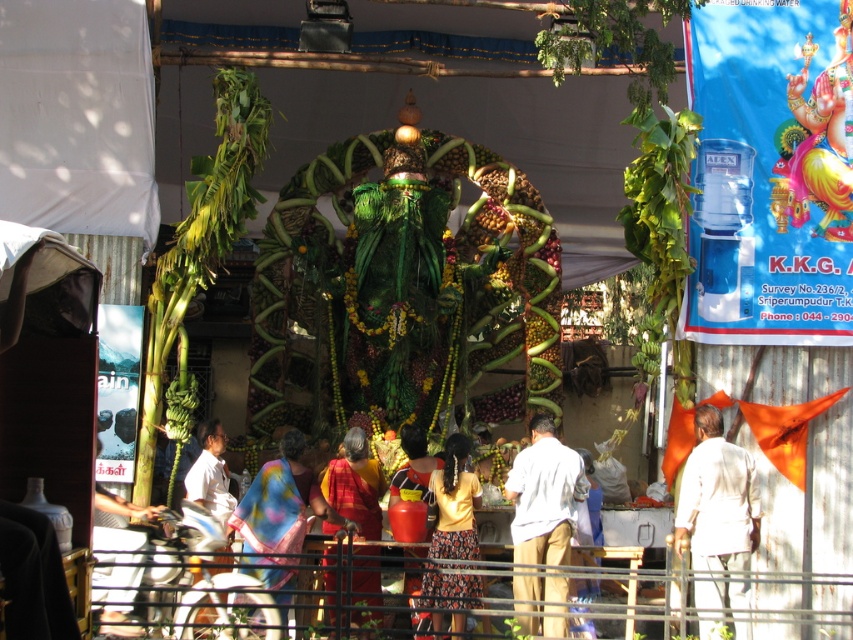
You are a photographer aiming to capture the metallic wire fence at lower center and the silky pink saree at center in a single frame. Considering their sizes, which object would require you to adjust your camera angle more to ensure both are fully visible?

The metallic wire fence at lower center requires more adjustment because its width surpasses that of the silky pink saree at center, necessitating a wider angle or closer positioning to accommodate its larger size while keeping both in frame.

You are part of the ceremony and need to cover the deity structure with the white cloth at center and the red silk saree at center. Which one can completely cover the structure due to its size?

The white cloth at center has a larger width than the red silk saree at center, so it can completely cover the structure.